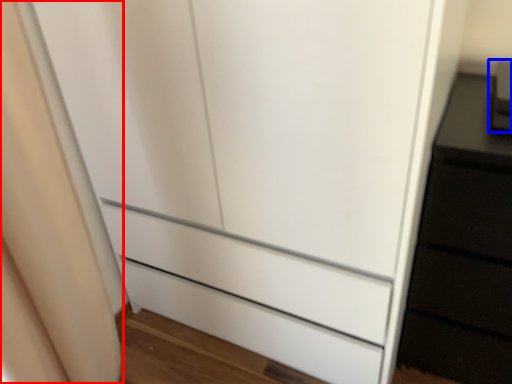
Question: Among these objects, which one is nearest to the camera, curtain (highlighted by a red box) or appliance (highlighted by a blue box)?

Choices:
 (A) curtain
 (B) appliance

Answer: (A)